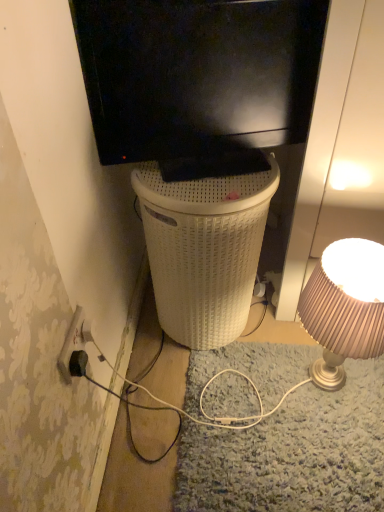
Describe the element at coordinates (344, 307) in the screenshot. I see `matte beige lampshade at right` at that location.

This screenshot has height=512, width=384. I want to click on black plastic power outlet at lower left, so click(x=70, y=344).

The width and height of the screenshot is (384, 512). In order to click on black matte television at upper center in this screenshot , I will do point(199,80).

Looking at their sizes, would you say black plastic power outlet at lower left is wider or thinner than white woven basket at center?

black plastic power outlet at lower left is thinner than white woven basket at center.

Which is more distant, [75,326] or [206,339]?

Positioned behind is point [206,339].

Which of these two, black plastic power outlet at lower left or white woven basket at center, is bigger?

Bigger between the two is white woven basket at center.

Based on the photo, is black plastic power outlet at lower left positioned with its back to matte beige lampshade at right?

No, black plastic power outlet at lower left is not facing the opposite direction of matte beige lampshade at right.

Where is `power outlet above the matte beige lampshade at right (from a real-world perspective)`? power outlet above the matte beige lampshade at right (from a real-world perspective) is located at coordinates (70, 344).

Which of these two, black plastic power outlet at lower left or matte beige lampshade at right, stands taller?

matte beige lampshade at right.

Which point is more distant from viewer, (73, 314) or (344, 379)?

The point (344, 379) is farther from the camera.

Considering the points (349, 240) and (96, 59), which point is behind, point (349, 240) or point (96, 59)?

The point (349, 240) is more distant.

Which of these two, matte beige lampshade at right or black matte television at upper center, is wider?

Wider between the two is matte beige lampshade at right.

The image size is (384, 512). I want to click on television in front of the matte beige lampshade at right, so click(x=199, y=80).

Which is more to the right, matte beige lampshade at right or black matte television at upper center?

Positioned to the right is matte beige lampshade at right.

Considering the sizes of matte beige lampshade at right and white woven basket at center in the image, is matte beige lampshade at right wider or thinner than white woven basket at center?

Considering their sizes, matte beige lampshade at right looks slimmer than white woven basket at center.

Which object is closer to the camera, matte beige lampshade at right or white woven basket at center?

Positioned in front is matte beige lampshade at right.

Could you tell me if matte beige lampshade at right is turned towards white woven basket at center?

No.

Would you say black matte television at upper center is a long distance from white woven basket at center?

black matte television at upper center is near white woven basket at center, not far away.

In order to click on trash bin/can beneath the black matte television at upper center (from a real-world perspective) in this screenshot , I will do `click(204, 250)`.

Can you tell me how much black matte television at upper center and white woven basket at center differ in facing direction?

The facing directions of black matte television at upper center and white woven basket at center are 18.6 degrees apart.

Based on the photo, in terms of height, does black matte television at upper center look taller or shorter compared to white woven basket at center?

In the image, black matte television at upper center appears to be shorter than white woven basket at center.

Can we say white woven basket at center lies outside black matte television at upper center?

Yes, white woven basket at center is outside of black matte television at upper center.

From a real-world perspective, between white woven basket at center and black matte television at upper center, who is vertically higher?

black matte television at upper center, from a real-world perspective.

What's the angular difference between white woven basket at center and black matte television at upper center's facing directions?

white woven basket at center and black matte television at upper center are facing 18.6 degrees away from each other.

In the scene shown: Which of these two, white woven basket at center or black matte television at upper center, is smaller?

black matte television at upper center.

From the image's perspective, is black matte television at upper center above black plastic power outlet at lower left?

Indeed, from the image's perspective, black matte television at upper center is shown above black plastic power outlet at lower left.

Is the position of black matte television at upper center more distant than that of black plastic power outlet at lower left?

No, the depth of black matte television at upper center is less than that of black plastic power outlet at lower left.

Considering the sizes of black matte television at upper center and black plastic power outlet at lower left in the image, is black matte television at upper center taller or shorter than black plastic power outlet at lower left?

In the image, black matte television at upper center appears to be taller than black plastic power outlet at lower left.

Locate an element on the screen. The height and width of the screenshot is (512, 384). trash bin/can that appears above the black plastic power outlet at lower left (from the image's perspective) is located at coordinates (204, 250).

At what (x,y) coordinates should I click in order to perform the action: click on power outlet on the left of matte beige lampshade at right. Please return your answer as a coordinate pair (x, y). Image resolution: width=384 pixels, height=512 pixels. Looking at the image, I should click on (70, 344).

Which object lies further to the anchor point matte beige lampshade at right, black plastic power outlet at lower left or black matte television at upper center?

black plastic power outlet at lower left is further to matte beige lampshade at right.

Considering their positions, is matte beige lampshade at right positioned further to black plastic power outlet at lower left than white woven basket at center?

Based on the image, matte beige lampshade at right appears to be further to black plastic power outlet at lower left.

Estimate the real-world distances between objects in this image. Which object is further from white woven basket at center, matte beige lampshade at right or black matte television at upper center?

matte beige lampshade at right lies further to white woven basket at center than the other object.

Estimate the real-world distances between objects in this image. Which object is further from matte beige lampshade at right, black matte television at upper center or black plastic power outlet at lower left?

Based on the image, black plastic power outlet at lower left appears to be further to matte beige lampshade at right.

Which object lies nearer to the anchor point white woven basket at center, black plastic power outlet at lower left or black matte television at upper center?

black matte television at upper center is closer to white woven basket at center.

Which object lies further to the anchor point black plastic power outlet at lower left, matte beige lampshade at right or black matte television at upper center?

Based on the image, matte beige lampshade at right appears to be further to black plastic power outlet at lower left.

In the scene shown: Estimate the real-world distances between objects in this image. Which object is closer to black plastic power outlet at lower left, black matte television at upper center or white woven basket at center?

The object closer to black plastic power outlet at lower left is white woven basket at center.

Considering their positions, is black matte television at upper center positioned closer to matte beige lampshade at right than white woven basket at center?

Based on the image, white woven basket at center appears to be nearer to matte beige lampshade at right.

Image resolution: width=384 pixels, height=512 pixels. I want to click on trash bin/can that lies between black matte television at upper center and matte beige lampshade at right from top to bottom, so click(x=204, y=250).

Identify the location of trash bin/can between black plastic power outlet at lower left and matte beige lampshade at right in the horizontal direction. (204, 250).

You are a GUI agent. You are given a task and a screenshot of the screen. Output one action in this format:
    pyautogui.click(x=<x>, y=<y>)
    Task: Click on the lamp between black matte television at upper center and black plastic power outlet at lower left from top to bottom
    The height and width of the screenshot is (512, 384).
    Given the screenshot: What is the action you would take?
    pyautogui.click(x=344, y=307)

Identify the location of trash bin/can between black matte television at upper center and black plastic power outlet at lower left vertically. (204, 250).